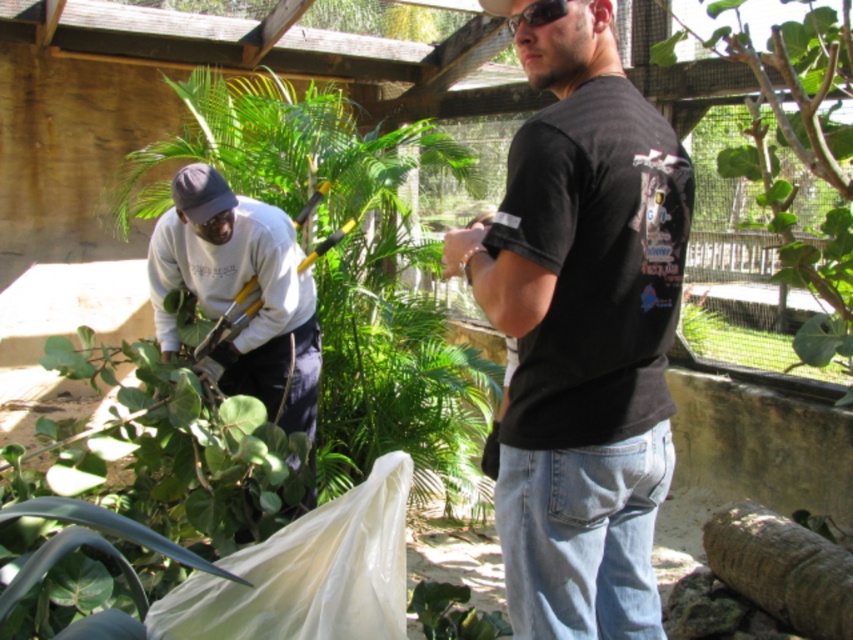
Question: In this image, where is black cotton t-shirt at center located relative to black plastic sunglasses at upper center?

Choices:
 (A) right
 (B) left

Answer: (A)

Question: Considering the real-world distances, which object is farthest from the gray cotton shirt at left?

Choices:
 (A) green leafy plant at center
 (B) black cotton t-shirt at center
 (C) black fabric baseball hat at upper center
 (D) green leafy plant at left

Answer: (A)

Question: Estimate the real-world distances between objects in this image. Which object is closer to the black cotton t-shirt at center?

Choices:
 (A) green leafy plant at left
 (B) black fabric baseball hat at upper center
 (C) gray cotton shirt at left

Answer: (B)

Question: Which point is farther from the camera taking this photo?

Choices:
 (A) (817, 68)
 (B) (334, 356)
 (C) (543, 24)

Answer: (B)

Question: Does green leafy plant at center have a smaller size compared to gray cotton shirt at left?

Choices:
 (A) no
 (B) yes

Answer: (A)

Question: Is green leafy plant at center thinner than black fabric baseball hat at upper center?

Choices:
 (A) no
 (B) yes

Answer: (A)